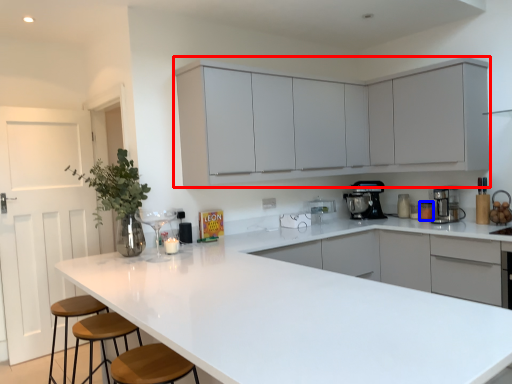
Question: Which object is further to the camera taking this photo, cabinetry (highlighted by a red box) or appliance (highlighted by a blue box)?

Choices:
 (A) cabinetry
 (B) appliance

Answer: (B)